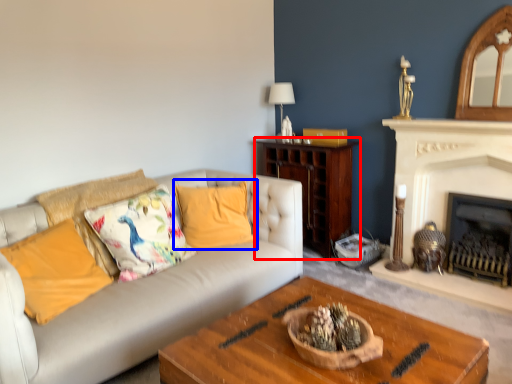
Question: Which of the following is the farthest to the observer, cabinetry (highlighted by a red box) or pillow (highlighted by a blue box)?

Choices:
 (A) cabinetry
 (B) pillow

Answer: (A)